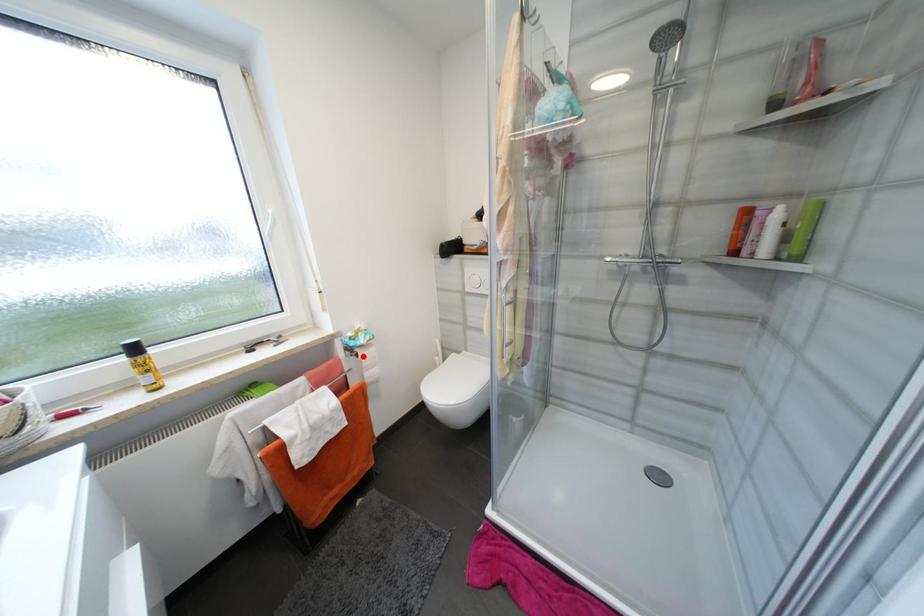
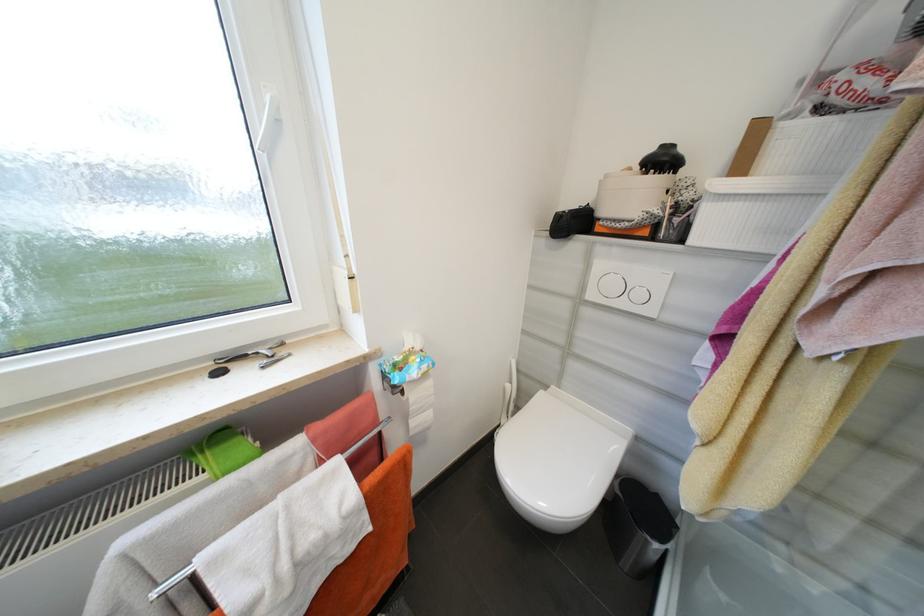
The point at the highlighted location is marked in the first image. Where is the corresponding point in the second image?

(407, 392)